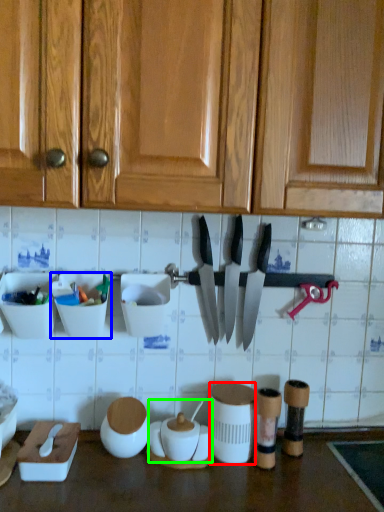
Question: Which is nearer to the tableware (highlighted by a red box)? tableware (highlighted by a blue box) or pottery (highlighted by a green box).

Choices:
 (A) tableware
 (B) pottery

Answer: (B)